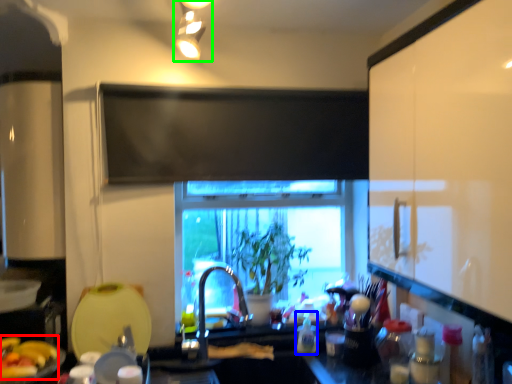
Question: Estimate the real-world distances between objects in this image. Which object is closer to food (highlighted by a red box), bottle (highlighted by a blue box) or light fixture (highlighted by a green box)?

Choices:
 (A) bottle
 (B) light fixture

Answer: (A)